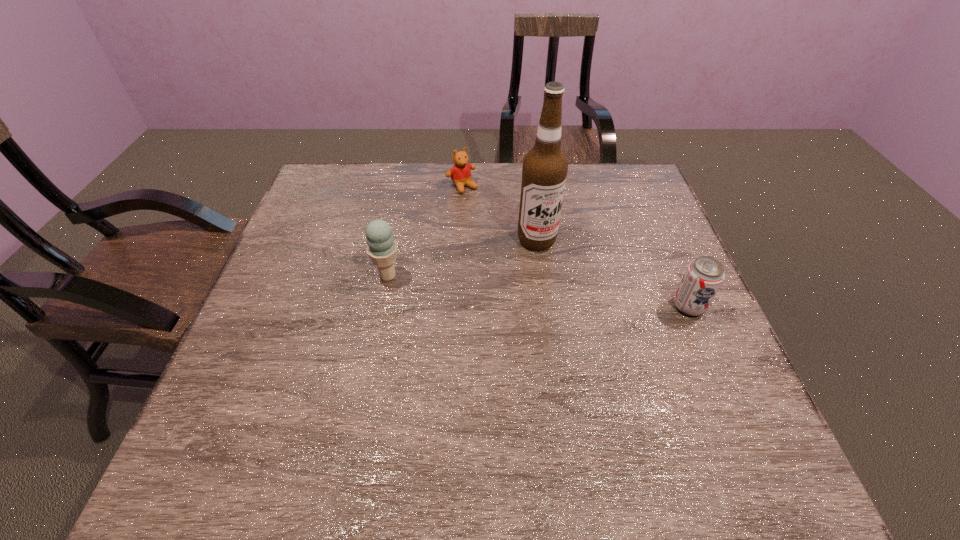
The height and width of the screenshot is (540, 960). Find the location of `ice cream`. ice cream is located at coordinates (381, 247).

Locate an element on the screen. The height and width of the screenshot is (540, 960). the second nearest object is located at coordinates (381, 247).

Image resolution: width=960 pixels, height=540 pixels. I want to click on the nearest object, so click(704, 276).

Where is `beer can`? beer can is located at coordinates (704, 276).

Find the location of a particular element. The width and height of the screenshot is (960, 540). teddy bear is located at coordinates (460, 173).

You are a GUI agent. You are given a task and a screenshot of the screen. Output one action in this format:
    pyautogui.click(x=<x>, y=<y>)
    Task: Click on the farthest object
    
    Given the screenshot: What is the action you would take?
    pyautogui.click(x=460, y=173)

At what (x,y) coordinates should I click in order to perform the action: click on the third nearest object. Please return your answer as a coordinate pair (x, y). The height and width of the screenshot is (540, 960). Looking at the image, I should click on (544, 171).

Where is `alcohol`? alcohol is located at coordinates (544, 171).

Where is `free region located on the right of the third shortest object`? free region located on the right of the third shortest object is located at coordinates (564, 276).

Identify the location of free region located on the back of the nearest object. (642, 198).